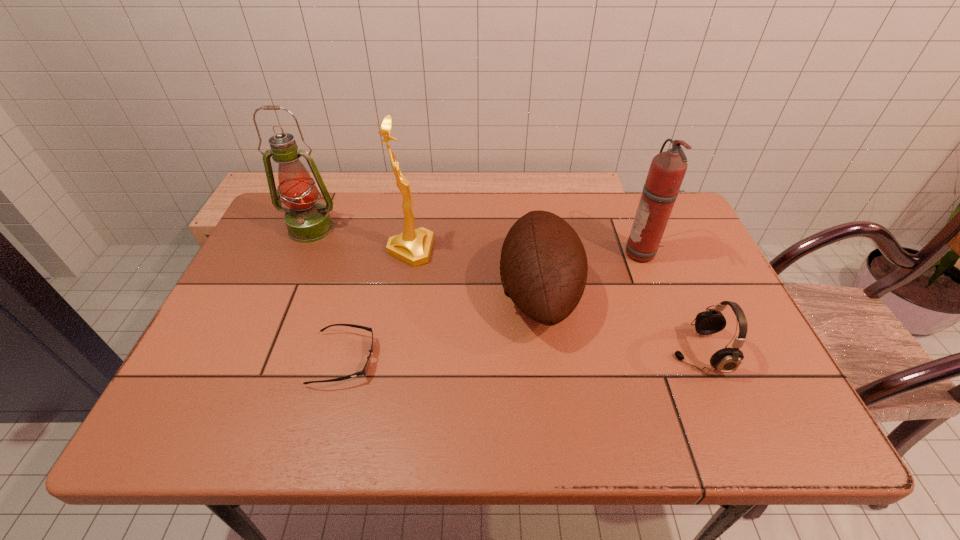
In the image, there is a desktop. Where is `vacant space at the right edge`? The width and height of the screenshot is (960, 540). vacant space at the right edge is located at coordinates (685, 245).

In the image, there is a desktop. At what (x,y) coordinates should I click in order to perform the action: click on free region at the near right corner. Please return your answer as a coordinate pair (x, y). Image resolution: width=960 pixels, height=540 pixels. Looking at the image, I should click on (790, 431).

Find the location of a particular element. This screenshot has width=960, height=540. empty location between the oil lamp and the shortest object is located at coordinates (327, 294).

Locate an element on the screen. vacant space that's between the award and the oil lamp is located at coordinates coord(361,239).

Image resolution: width=960 pixels, height=540 pixels. Identify the location of vacant space that is in between the award and the sunglasses. (377, 305).

I want to click on vacant space that's between the fire extinguisher and the shortest object, so click(493, 307).

I want to click on unoccupied area between the third object from right to left and the award, so click(x=474, y=272).

You are a GUI agent. You are given a task and a screenshot of the screen. Output one action in this format:
    pyautogui.click(x=<x>, y=<y>)
    Task: Click on the unoccupied position between the fire extinguisher and the second shortest object
    Image resolution: width=960 pixels, height=540 pixels.
    Given the screenshot: What is the action you would take?
    click(671, 303)

At what (x,y) coordinates should I click in order to perform the action: click on free space between the sunglasses and the fourth object from left to right. Please return your answer as a coordinate pair (x, y). The width and height of the screenshot is (960, 540). Looking at the image, I should click on (442, 326).

Find the location of a particular element. This screenshot has width=960, height=540. unoccupied area between the fire extinguisher and the sunglasses is located at coordinates (493, 307).